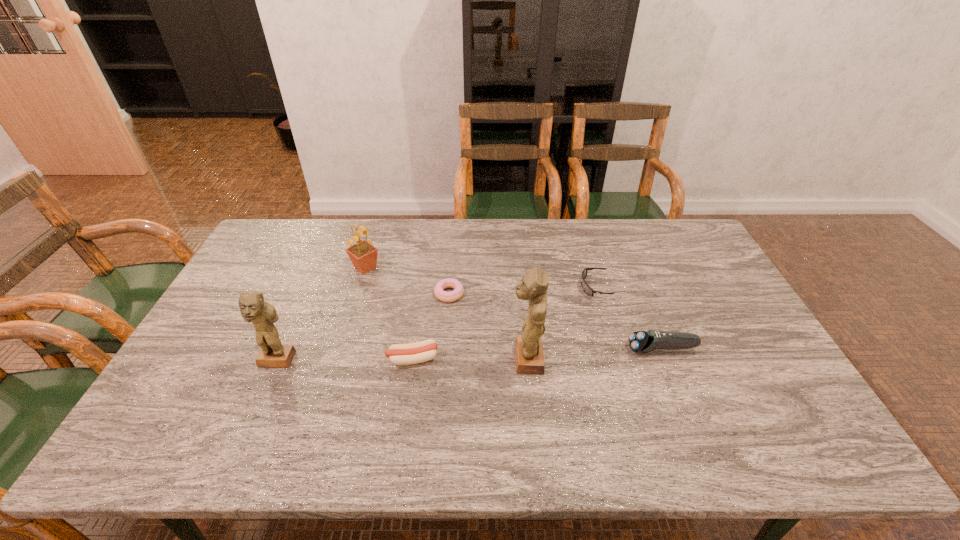
All figurines are currently evenly spaced. To continue this pattern, where would you add another figurine on the right? Please point out a vacant spot. Please provide its 2D coordinates. Your answer should be formatted as a tuple, i.e. [(x, y)], where the tuple contains the x and y coordinates of a point satisfying the conditions above.

[(774, 356)]